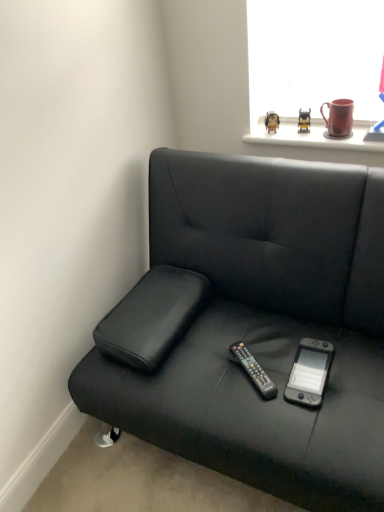
Question: From the image's perspective, is matte black figurine at upper center, marked as the 2th toy in a left-to-right arrangement, located above or below black plastic remote at center?

Choices:
 (A) above
 (B) below

Answer: (A)

Question: Is matte black figurine at upper center, the first toy from the right, taller or shorter than black plastic remote at center?

Choices:
 (A) tall
 (B) short

Answer: (A)

Question: Considering the real-world distances, which object is farthest from the matte black figurine at upper center, positioned as the 1th toy in left-to-right order?

Choices:
 (A) black leather studio couch at lower left
 (B) matte red mug at upper right
 (C) matte black figurine at upper center, the first toy from the right
 (D) gray matte nintendo switch at center
 (E) black plastic remote at center

Answer: (D)

Question: Which is nearer to the gray matte nintendo switch at center?

Choices:
 (A) black leather studio couch at lower left
 (B) black plastic remote at center
 (C) matte black figurine at upper center, the first toy from the right
 (D) matte black figurine at upper center, which appears as the second toy when viewed from the right
 (E) matte red mug at upper right

Answer: (B)